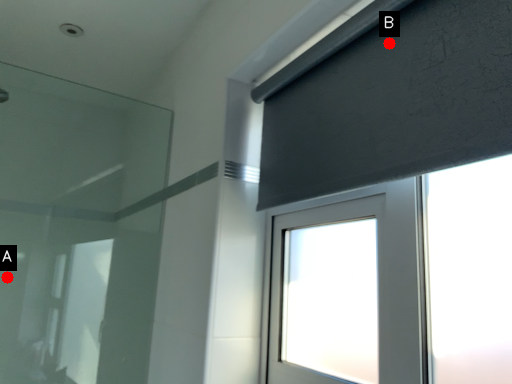
Question: Two points are circled on the image, labeled by A and B beside each circle. Which of the following is the farthest from the observer?

Choices:
 (A) A is further
 (B) B is further

Answer: (A)